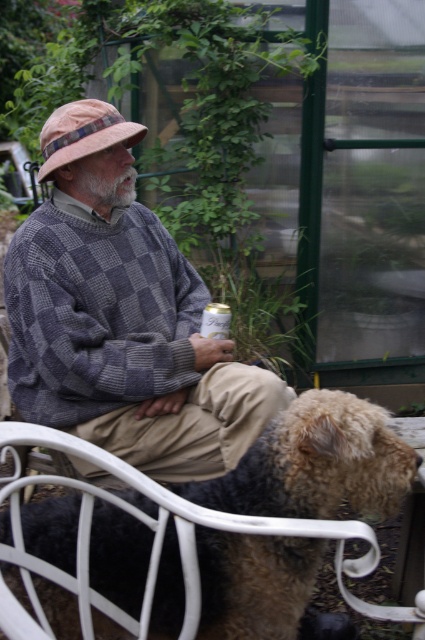
Question: Does fuzzy brown fur at lower center come in front of metallic can at center?

Choices:
 (A) yes
 (B) no

Answer: (A)

Question: Does checkered wool sweater at center have a lesser width compared to fuzzy brown fur at lower center?

Choices:
 (A) no
 (B) yes

Answer: (B)

Question: Which object is farther from the camera taking this photo?

Choices:
 (A) metallic can at center
 (B) checkered wool sweater at center

Answer: (A)

Question: Which object appears closest to the camera in this image?

Choices:
 (A) fuzzy brown fur at lower center
 (B) checkered wool sweater at center

Answer: (A)

Question: Which object is farther from the camera taking this photo?

Choices:
 (A) checkered wool sweater at center
 (B) fuzzy brown fur at lower center
 (C) metallic can at center

Answer: (C)

Question: Is checkered wool sweater at center thinner than metallic can at center?

Choices:
 (A) yes
 (B) no

Answer: (B)